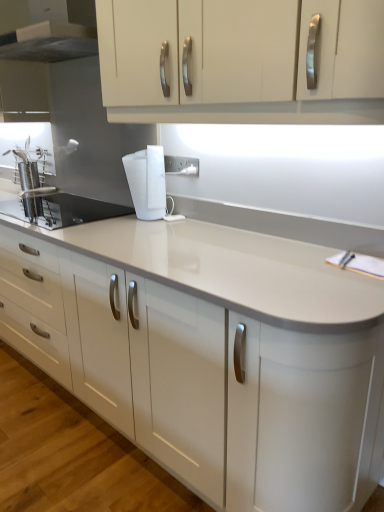
What is the approximate width of white plastic electric outlet at center?

white plastic electric outlet at center is 0.49 inches wide.

The height and width of the screenshot is (512, 384). Identify the location of satin steel sink at left. (61, 210).

Is white matte mug at center at the right side of brushed metal range hood at upper left?

Indeed, white matte mug at center is positioned on the right side of brushed metal range hood at upper left.

Find the location of a particular element. The height and width of the screenshot is (512, 384). home appliance on the left of white matte mug at center is located at coordinates (53, 35).

From a real-world perspective, is white matte mug at center over brushed metal range hood at upper left?

Incorrect, from a real-world perspective, white matte mug at center is lower than brushed metal range hood at upper left.

Is white glossy countertop at center in contact with brushed metal range hood at upper left?

No, white glossy countertop at center is not beside brushed metal range hood at upper left.

Between white glossy countertop at center and brushed metal range hood at upper left, which one has larger size?

white glossy countertop at center.

How far apart are white glossy countertop at center and brushed metal range hood at upper left?

1.25 meters.

Is white glossy cabinet at upper center at the right side of white plastic electric outlet at center?

Indeed, white glossy cabinet at upper center is positioned on the right side of white plastic electric outlet at center.

Considering the sizes of objects white glossy cabinet at upper center and white plastic electric outlet at center in the image provided, who is shorter, white glossy cabinet at upper center or white plastic electric outlet at center?

white plastic electric outlet at center.

In order to click on cabinetry above the white plastic electric outlet at center (from the image's perspective) in this screenshot , I will do `click(242, 61)`.

Are white glossy cabinet at upper center and white plastic electric outlet at center located far from each other?

white glossy cabinet at upper center is actually quite close to white plastic electric outlet at center.

Where is `cabinetry lying below the brushed metal range hood at upper left (from the image's perspective)`? This screenshot has height=512, width=384. cabinetry lying below the brushed metal range hood at upper left (from the image's perspective) is located at coordinates (242, 61).

From a real-world perspective, which is physically below, white glossy cabinet at upper center or brushed metal range hood at upper left?

In real-world perspective, white glossy cabinet at upper center is lower.

Is white glossy cabinet at upper center next to brushed metal range hood at upper left and touching it?

No, white glossy cabinet at upper center is not with brushed metal range hood at upper left.

Does white glossy countertop at center have a greater height compared to white glossy cabinet at upper center?

Indeed, white glossy countertop at center has a greater height compared to white glossy cabinet at upper center.

Between white glossy countertop at center and white glossy cabinet at upper center, which one has smaller size?

With smaller size is white glossy cabinet at upper center.

Measure the distance between white glossy countertop at center and white glossy cabinet at upper center.

white glossy countertop at center and white glossy cabinet at upper center are 73.43 centimeters apart from each other.

Can you confirm if white glossy countertop at center is shorter than white plastic electric outlet at center?

In fact, white glossy countertop at center may be taller than white plastic electric outlet at center.

Which is in front, point (57, 365) or point (194, 167)?

The point (194, 167) is more forward.

Image resolution: width=384 pixels, height=512 pixels. I want to click on countertop on the left side of white plastic electric outlet at center, so click(x=218, y=355).

Are white glossy countertop at center and white plastic electric outlet at center far apart?

Actually, white glossy countertop at center and white plastic electric outlet at center are a little close together.

Could you tell me if white matte mug at center is facing white glossy cabinet at upper center?

No, white matte mug at center is not facing towards white glossy cabinet at upper center.

From a real-world perspective, which is physically below, white matte mug at center or white glossy cabinet at upper center?

white matte mug at center.

Can white glossy cabinet at upper center be found inside white matte mug at center?

No.

Does white matte mug at center lie behind white glossy cabinet at upper center?

Yes, it is behind white glossy cabinet at upper center.

What are the coordinates of `home appliance in front of the white matte mug at center` in the screenshot? It's located at (53, 35).

Locate an element on the screen. Image resolution: width=384 pixels, height=512 pixels. home appliance above the white glossy countertop at center (from the image's perspective) is located at coordinates (53, 35).

Based on their spatial positions, is white glossy cabinet at upper center or satin steel sink at left closer to brushed metal range hood at upper left?

Based on the image, white glossy cabinet at upper center appears to be nearer to brushed metal range hood at upper left.

When comparing their distances from white glossy countertop at center, does satin steel sink at left or brushed metal range hood at upper left seem closer?

satin steel sink at left lies closer to white glossy countertop at center than the other object.

Which object lies further to the anchor point white glossy cabinet at upper center, brushed metal range hood at upper left or white plastic electric outlet at center?

brushed metal range hood at upper left is positioned further to the anchor white glossy cabinet at upper center.

When comparing their distances from brushed metal range hood at upper left, does white matte mug at center or white glossy cabinet at upper center seem further?

The object further to brushed metal range hood at upper left is white matte mug at center.

From the image, which object appears to be farther from brushed metal range hood at upper left, satin steel sink at left or white matte mug at center?

The object further to brushed metal range hood at upper left is satin steel sink at left.

Looking at the image, which one is located closer to brushed metal range hood at upper left, white matte mug at center or satin steel sink at left?

The object closer to brushed metal range hood at upper left is white matte mug at center.

Considering their positions, is white glossy countertop at center positioned closer to satin steel sink at left than white glossy cabinet at upper center?

Among the two, white glossy countertop at center is located nearer to satin steel sink at left.

Estimate the real-world distances between objects in this image. Which object is closer to white glossy cabinet at upper center, brushed metal range hood at upper left or satin steel sink at left?

The object closer to white glossy cabinet at upper center is brushed metal range hood at upper left.

Locate an element on the screen. The image size is (384, 512). electric outlet that lies between brushed metal range hood at upper left and white matte mug at center from top to bottom is located at coordinates (185, 166).

Image resolution: width=384 pixels, height=512 pixels. In order to click on sink between white glossy countertop at center and white plastic electric outlet at center in the front-back direction in this screenshot , I will do `click(61, 210)`.

Where is `kitchen appliance between satin steel sink at left and white plastic electric outlet at center from left to right`? The image size is (384, 512). kitchen appliance between satin steel sink at left and white plastic electric outlet at center from left to right is located at coordinates (x=147, y=182).

This screenshot has width=384, height=512. I want to click on home appliance positioned between white glossy countertop at center and white matte mug at center from near to far, so click(53, 35).